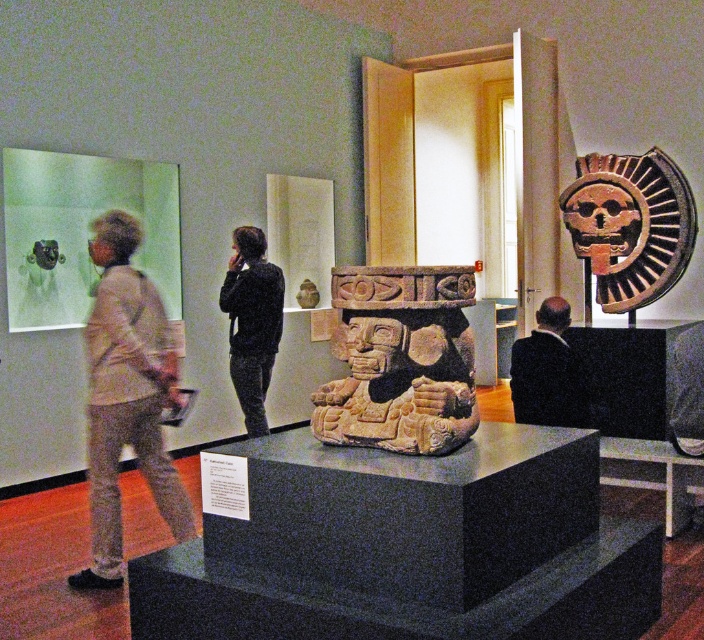
Question: Does carved stone sculpture at center have a lesser width compared to brown terracotta mask at upper right?

Choices:
 (A) yes
 (B) no

Answer: (A)

Question: Based on their relative distances, which object is nearer to the light beige sweater at left?

Choices:
 (A) brown terracotta mask at upper right
 (B) carved stone sculpture at center

Answer: (B)

Question: Which is farther from the light beige sweater at left?

Choices:
 (A) carved stone sculpture at center
 (B) black suit at center
 (C) black textured jacket at center
 (D) brown terracotta mask at upper right

Answer: (D)

Question: Which object is closer to the camera taking this photo?

Choices:
 (A) brown terracotta mask at upper right
 (B) carved stone sculpture at center
 (C) black suit at center
 (D) light beige sweater at left

Answer: (B)

Question: Can you confirm if brown terracotta mask at upper right is thinner than black textured jacket at center?

Choices:
 (A) no
 (B) yes

Answer: (A)

Question: Is black textured jacket at center above black suit at center?

Choices:
 (A) yes
 (B) no

Answer: (A)